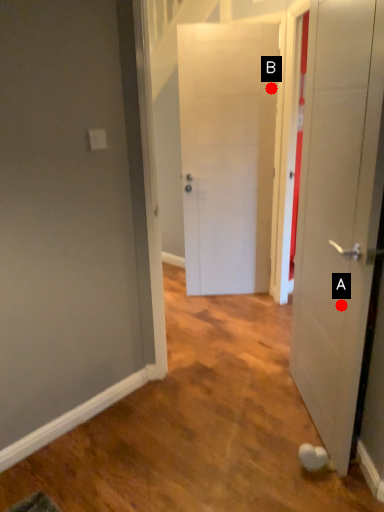
Question: Two points are circled on the image, labeled by A and B beside each circle. Which point is farther to the camera?

Choices:
 (A) A is further
 (B) B is further

Answer: (B)